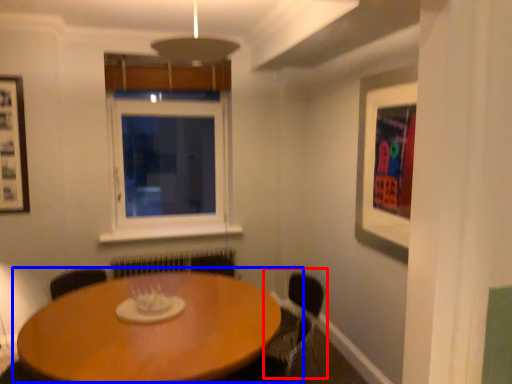
Question: Which of the following is the closest to the observer, armchair (highlighted by a red box) or table (highlighted by a blue box)?

Choices:
 (A) armchair
 (B) table

Answer: (B)